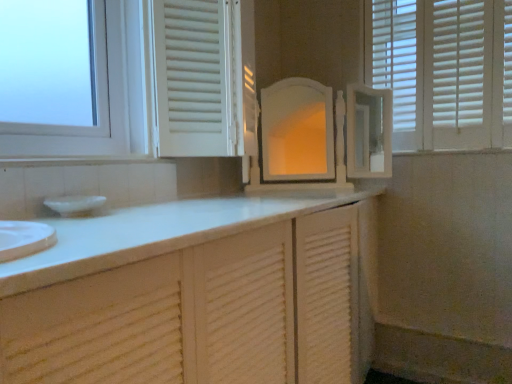
Question: Relative to white matte blinds at upper right, is white glossy window sill at upper left in front or behind?

Choices:
 (A) behind
 (B) front

Answer: (B)

Question: From the image's perspective, is white glossy window sill at upper left positioned above or below white matte blinds at upper right?

Choices:
 (A) above
 (B) below

Answer: (B)

Question: Is white glossy window sill at upper left to the left or to the right of white matte blinds at upper right in the image?

Choices:
 (A) left
 (B) right

Answer: (A)

Question: Considering their positions, is white matte blinds at upper right located in front of or behind white glossy window sill at upper left?

Choices:
 (A) front
 (B) behind

Answer: (B)

Question: In terms of width, does white matte blinds at upper right look wider or thinner when compared to white glossy window sill at upper left?

Choices:
 (A) wide
 (B) thin

Answer: (B)

Question: From their relative heights in the image, would you say white matte blinds at upper right is taller or shorter than white glossy window sill at upper left?

Choices:
 (A) tall
 (B) short

Answer: (A)

Question: Is point (499, 1) closer or farther from the camera than point (138, 160)?

Choices:
 (A) farther
 (B) closer

Answer: (A)